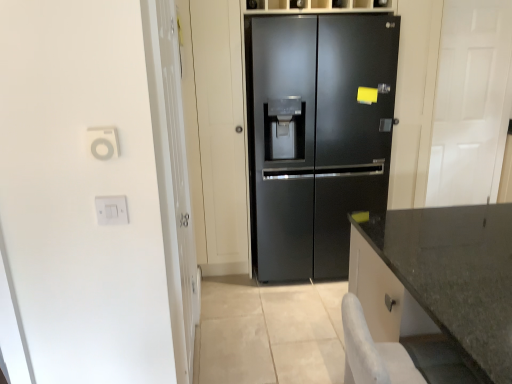
Question: Based on their positions, is white plastic outlet at upper left, the 1th electric outlet from the top, located to the left or right of white plastic switch at left, arranged as the 1th electric outlet when ordered from the bottom?

Choices:
 (A) left
 (B) right

Answer: (A)

Question: Considering the positions of point (94, 140) and point (124, 221), is point (94, 140) closer or farther from the camera than point (124, 221)?

Choices:
 (A) closer
 (B) farther

Answer: (A)

Question: Based on their relative distances, which object is farther from the granite gray countertop at lower right?

Choices:
 (A) white plastic outlet at upper left, the 1th electric outlet from the top
 (B) white plastic switch at left, arranged as the 1th electric outlet when ordered from the bottom
 (C) transparent glass door at left, which appears as the 2th glass door when viewed from the right
 (D) black matte refrigerator at center
 (E) white glossy door at right, marked as the second glass door in a left-to-right arrangement

Answer: (A)

Question: Estimate the real-world distances between objects in this image. Which object is closer to the white glossy door at right, marked as the second glass door in a left-to-right arrangement?

Choices:
 (A) white plastic outlet at upper left, which is counted as the second electric outlet, starting from the bottom
 (B) granite gray countertop at lower right
 (C) transparent glass door at left, which is the first glass door from front to back
 (D) white plastic switch at left, arranged as the second electric outlet when viewed from the front
 (E) black matte refrigerator at center

Answer: (E)